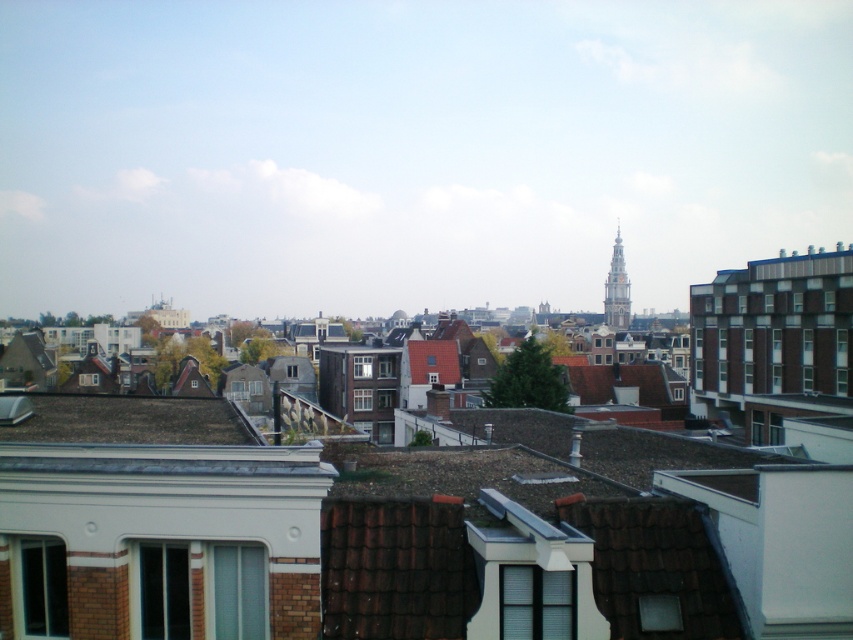
Is brown shingles at lower left thinner than golden stone tower at upper right?

Yes.

The width and height of the screenshot is (853, 640). What do you see at coordinates (129, 420) in the screenshot?
I see `brown shingles at lower left` at bounding box center [129, 420].

Which is behind, point (117, 417) or point (621, 317)?

The point (621, 317) is behind.

Where is `brown shingles at lower left`? This screenshot has height=640, width=853. brown shingles at lower left is located at coordinates (129, 420).